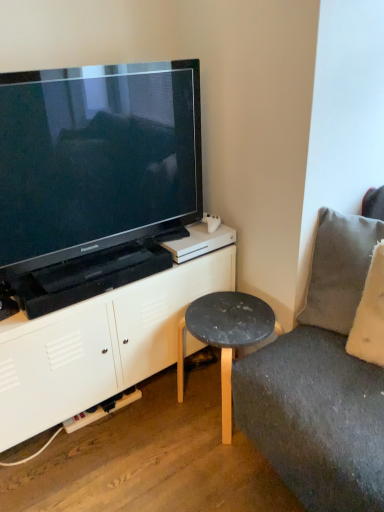
Identify the location of vacant space situated above matte black stool at lower center (from a real-world perspective). This screenshot has width=384, height=512. (225, 314).